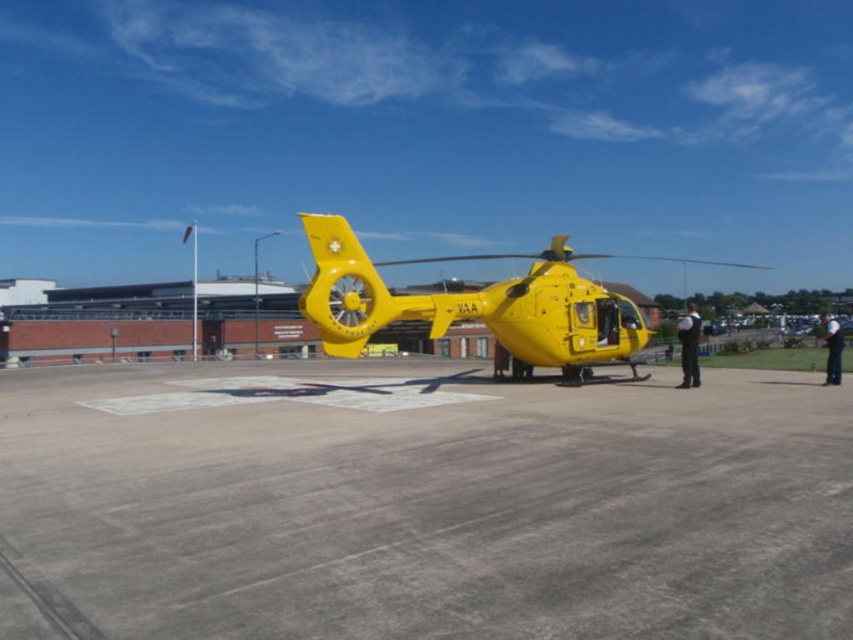
Is point (585, 289) positioned after point (828, 326)?

That is True.

Who is positioned more to the right, yellow matte helicopter at center or black fabric person at right?

From the viewer's perspective, black fabric person at right appears more on the right side.

Does point (456, 320) lie behind point (828, 321)?

No, (456, 320) is in front of (828, 321).

Where is `yellow matte helicopter at center`? The image size is (853, 640). yellow matte helicopter at center is located at coordinates (473, 305).

Can you confirm if black leather jacket at right is smaller than black fabric person at right?

Yes, black leather jacket at right is smaller than black fabric person at right.

Where is `black leather jacket at right`? Image resolution: width=853 pixels, height=640 pixels. black leather jacket at right is located at coordinates coord(689,348).

At what (x,y) coordinates should I click in order to perform the action: click on gray concrete tarmac at center. Please return your answer as a coordinate pair (x, y). This screenshot has height=640, width=853. Looking at the image, I should click on (421, 502).

Can you confirm if gray concrete tarmac at center is bigger than yellow matte helicopter at center?

No, gray concrete tarmac at center is not bigger than yellow matte helicopter at center.

This screenshot has width=853, height=640. What do you see at coordinates (421, 502) in the screenshot?
I see `gray concrete tarmac at center` at bounding box center [421, 502].

Identify the location of gray concrete tarmac at center. (421, 502).